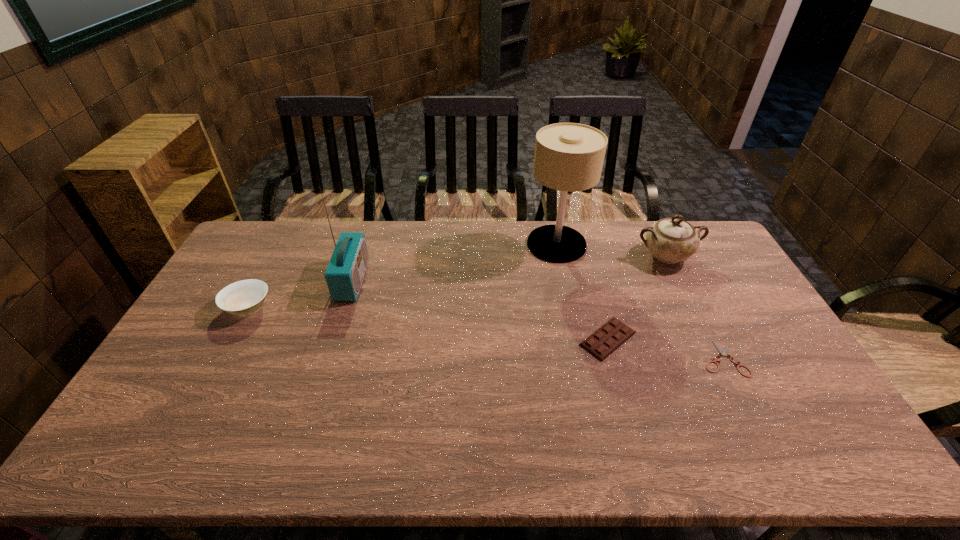
Identify the location of free space located 0.220m on the left of the fourth shortest object. This screenshot has height=540, width=960. (573, 256).

Where is `vacant space located on the front of the leftmost object`? The image size is (960, 540). vacant space located on the front of the leftmost object is located at coordinates (204, 390).

The width and height of the screenshot is (960, 540). I want to click on free spot located on the left of the second shortest object, so click(496, 339).

Where is `vacant space positioned on the front of the shears`? vacant space positioned on the front of the shears is located at coordinates [x=751, y=414].

Where is `table lamp at the far edge`? The image size is (960, 540). table lamp at the far edge is located at coordinates (569, 157).

At what (x,y) coordinates should I click in order to perform the action: click on radio receiver present at the far edge. Please return your answer as a coordinate pair (x, y). Looking at the image, I should click on (345, 272).

Where is `chinaware that is positioned at the far edge`? The width and height of the screenshot is (960, 540). chinaware that is positioned at the far edge is located at coordinates (671, 240).

Where is `object that is at the left edge`? The image size is (960, 540). object that is at the left edge is located at coordinates click(245, 297).

This screenshot has height=540, width=960. In order to click on chinaware that is at the right edge in this screenshot , I will do `click(671, 240)`.

Where is `shears that is at the right edge`? shears that is at the right edge is located at coordinates (724, 352).